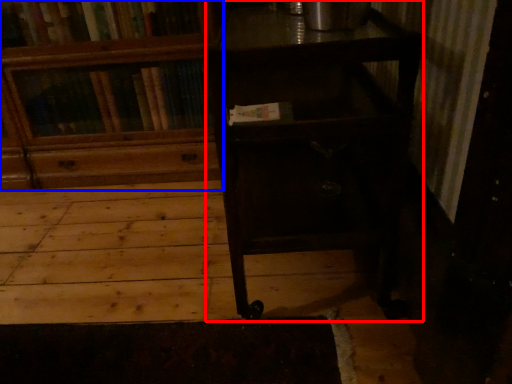
Question: Among these objects, which one is nearest to the camera, table (highlighted by a red box) or bookcase (highlighted by a blue box)?

Choices:
 (A) table
 (B) bookcase

Answer: (A)